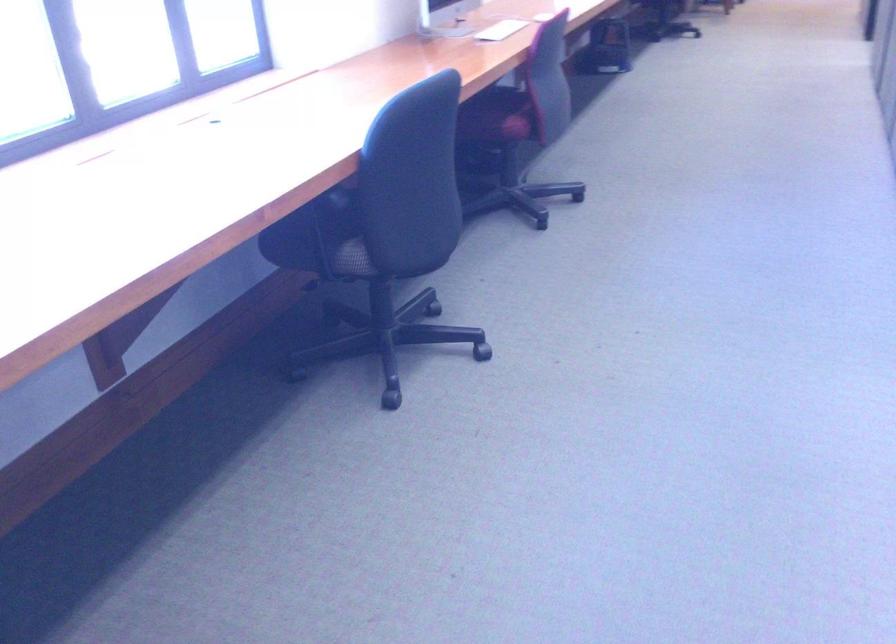
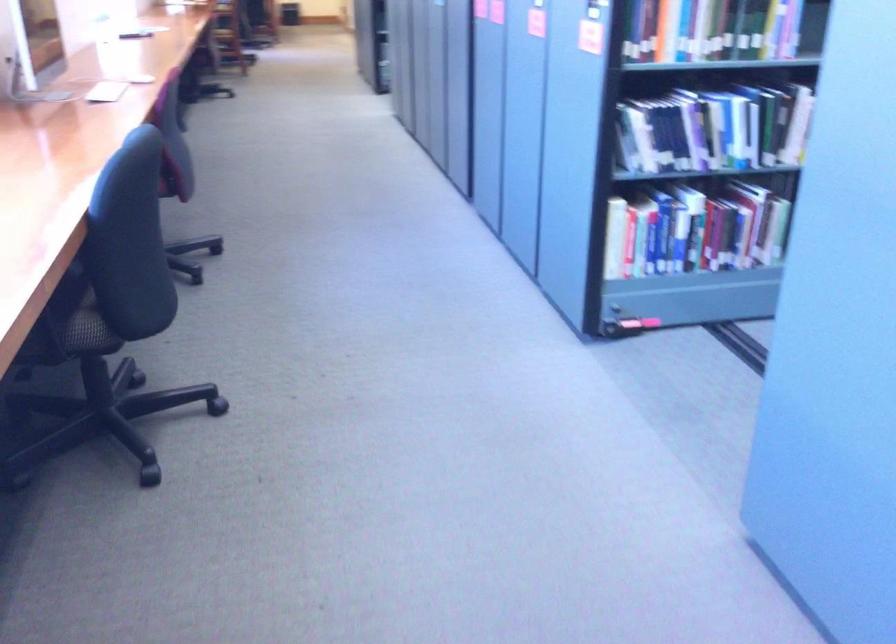
Question: The first image is from the beginning of the video and the second image is from the end. How did the camera likely rotate when shooting the video?

Choices:
 (A) Left
 (B) Right
 (C) Up
 (D) Down

Answer: (B)